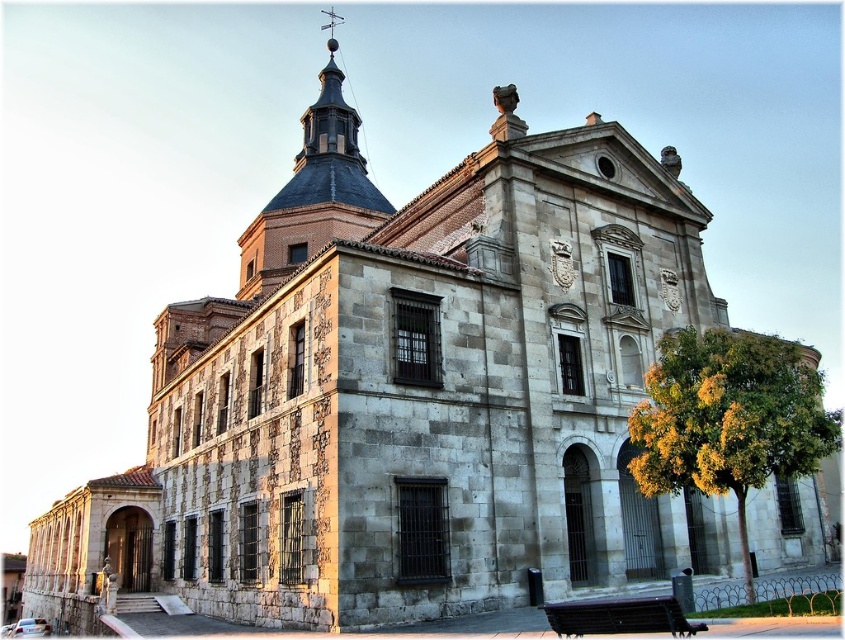
Question: Which point is closer to the camera?

Choices:
 (A) (260, 220)
 (B) (587, 605)

Answer: (B)

Question: Which of the following is the farthest from the observer?

Choices:
 (A) wooden bench at lower center
 (B) smooth stone spire at upper center

Answer: (B)

Question: Is smooth stone spire at upper center smaller than wooden bench at lower center?

Choices:
 (A) no
 (B) yes

Answer: (A)

Question: Is smooth stone spire at upper center thinner than wooden bench at lower center?

Choices:
 (A) yes
 (B) no

Answer: (B)

Question: Does smooth stone spire at upper center come behind wooden bench at lower center?

Choices:
 (A) no
 (B) yes

Answer: (B)